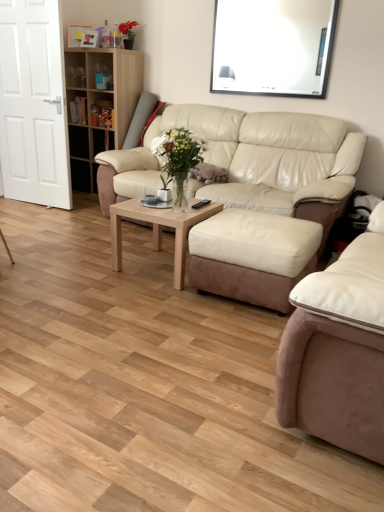
The height and width of the screenshot is (512, 384). In order to click on free location in front of light brown wood coffee table at center in this screenshot , I will do `click(153, 296)`.